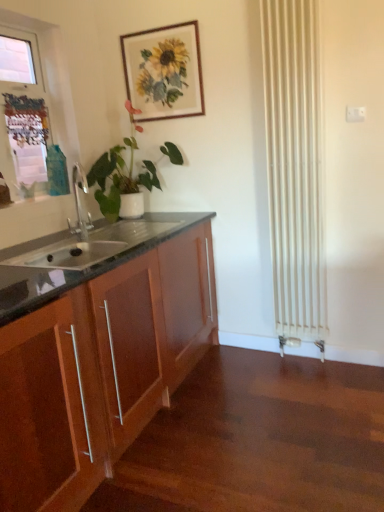
Question: From a real-world perspective, is green matte plant at left on top of wooden cabinet at left?

Choices:
 (A) no
 (B) yes

Answer: (B)

Question: Can you confirm if green matte plant at left is thinner than wooden cabinet at left?

Choices:
 (A) yes
 (B) no

Answer: (A)

Question: Is green matte plant at left oriented away from wooden cabinet at left?

Choices:
 (A) yes
 (B) no

Answer: (B)

Question: Is green matte plant at left positioned before wooden cabinet at left?

Choices:
 (A) yes
 (B) no

Answer: (B)

Question: From the image's perspective, is green matte plant at left above wooden cabinet at left?

Choices:
 (A) no
 (B) yes

Answer: (B)

Question: Is white plastic window frame at upper left in front of or behind wooden picture frame at upper center in the image?

Choices:
 (A) behind
 (B) front

Answer: (B)

Question: Looking at the image, does white plastic window frame at upper left seem bigger or smaller compared to wooden picture frame at upper center?

Choices:
 (A) big
 (B) small

Answer: (A)

Question: Would you say white plastic window frame at upper left is to the left or to the right of wooden picture frame at upper center in the picture?

Choices:
 (A) right
 (B) left

Answer: (B)

Question: Is white plastic window frame at upper left inside or outside of wooden picture frame at upper center?

Choices:
 (A) outside
 (B) inside

Answer: (A)

Question: From the image's perspective, relative to wooden cabinet at left, is green matte plant at left above or below?

Choices:
 (A) below
 (B) above

Answer: (B)

Question: Is green matte plant at left taller or shorter than wooden cabinet at left?

Choices:
 (A) short
 (B) tall

Answer: (A)

Question: Considering the positions of point (94, 164) and point (155, 336), is point (94, 164) closer or farther from the camera than point (155, 336)?

Choices:
 (A) closer
 (B) farther

Answer: (B)

Question: Based on their sizes in the image, would you say green matte plant at left is bigger or smaller than wooden cabinet at left?

Choices:
 (A) big
 (B) small

Answer: (B)

Question: Is white plastic window frame at upper left in front of or behind wooden cabinet at left in the image?

Choices:
 (A) behind
 (B) front

Answer: (A)

Question: Considering the positions of point (69, 156) and point (177, 274), is point (69, 156) closer or farther from the camera than point (177, 274)?

Choices:
 (A) farther
 (B) closer

Answer: (A)